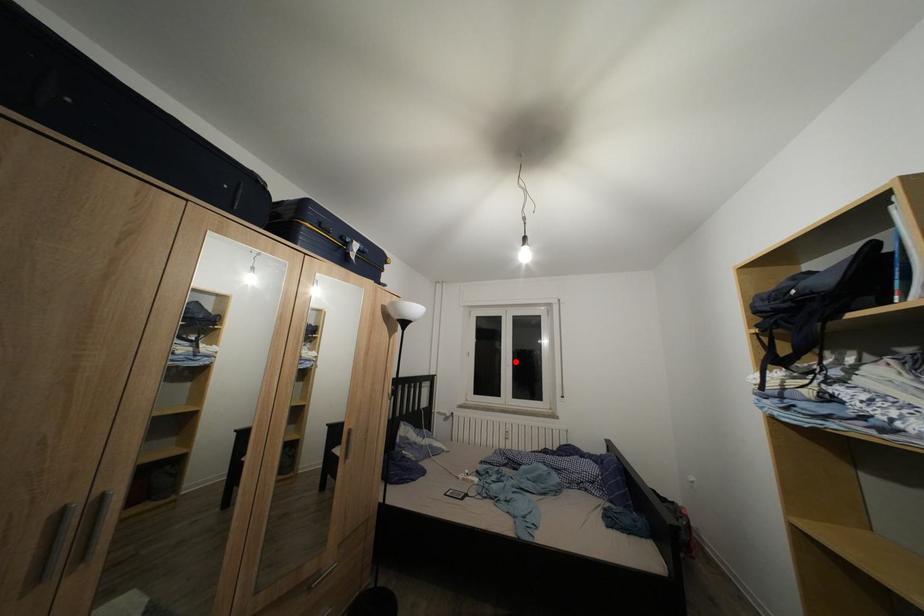
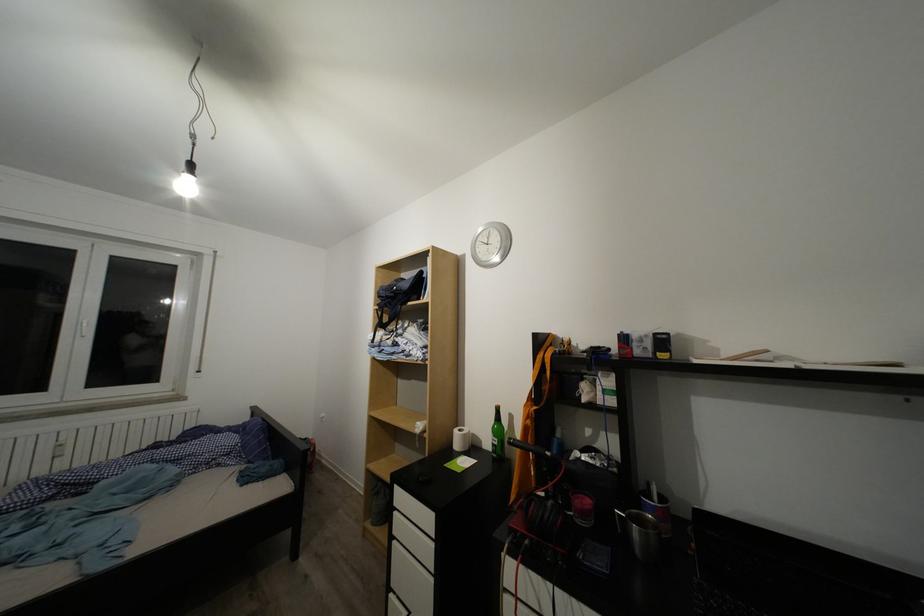
Question: A red point is marked in image1. In image2, is the corresponding 3D point closer to the camera or farther? Reply with the corresponding letter.

Choices:
 (A) The corresponding 3D point is closer.
 (B) The corresponding 3D point is farther.

Answer: (A)